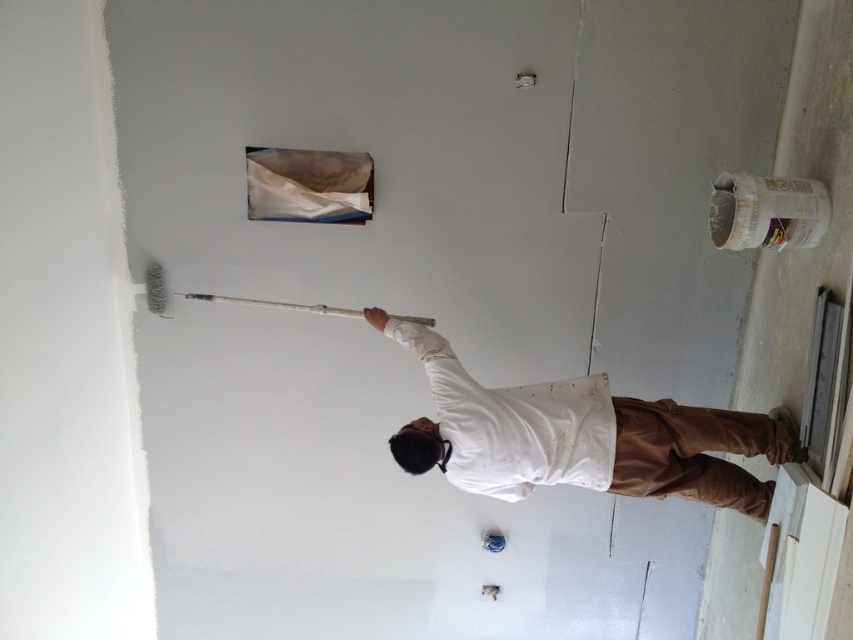
Question: In this image, where is white paper at upper center located relative to white synthetic paint roller at upper center?

Choices:
 (A) above
 (B) below

Answer: (A)

Question: Estimate the real-world distances between objects in this image. Which object is farther from the white paper at upper center?

Choices:
 (A) white synthetic paint roller at upper center
 (B) white matte shirt at center

Answer: (B)

Question: Estimate the real-world distances between objects in this image. Which object is closer to the white synthetic paint roller at upper center?

Choices:
 (A) white matte shirt at center
 (B) white paper at upper center

Answer: (B)

Question: Is white matte shirt at center further to the viewer compared to white synthetic paint roller at upper center?

Choices:
 (A) yes
 (B) no

Answer: (B)

Question: Estimate the real-world distances between objects in this image. Which object is closer to the white paper at upper center?

Choices:
 (A) white synthetic paint roller at upper center
 (B) white matte shirt at center

Answer: (A)

Question: Does white matte shirt at center have a larger size compared to white paper at upper center?

Choices:
 (A) no
 (B) yes

Answer: (B)